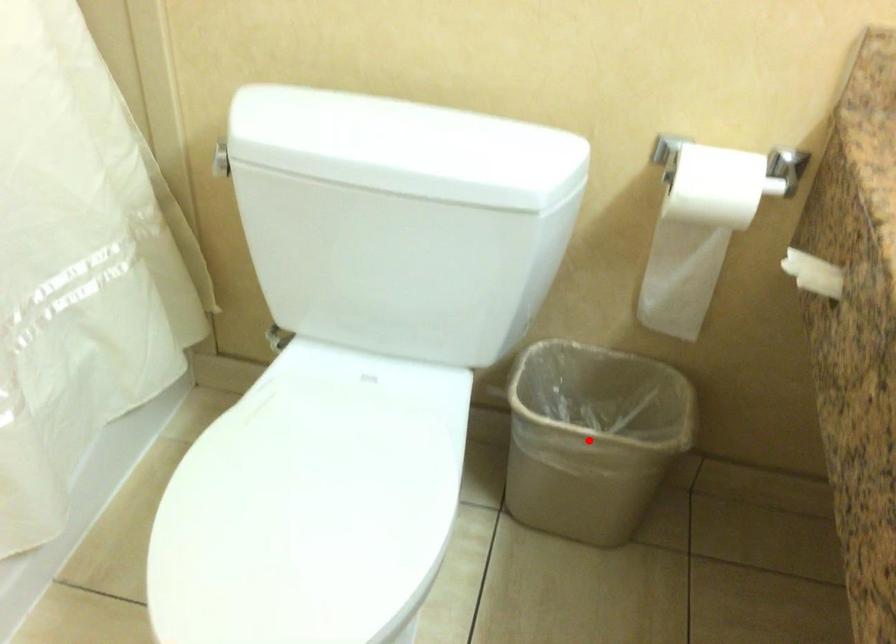
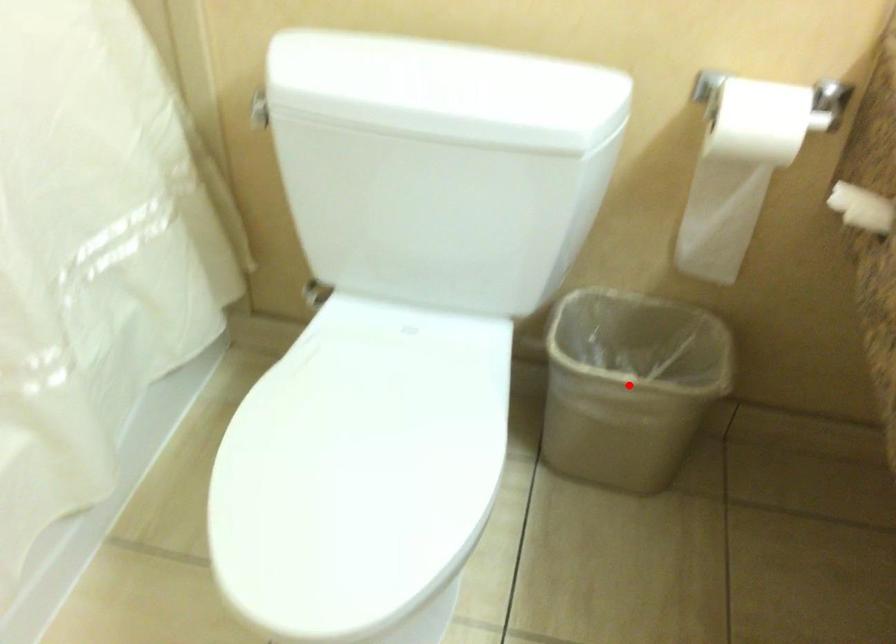
I am providing you with two images of the same scene from different viewpoints. A red point is marked on the first image and another point is marked on the second image. Is the red point in image1 aligned with the point shown in image2?

Yes